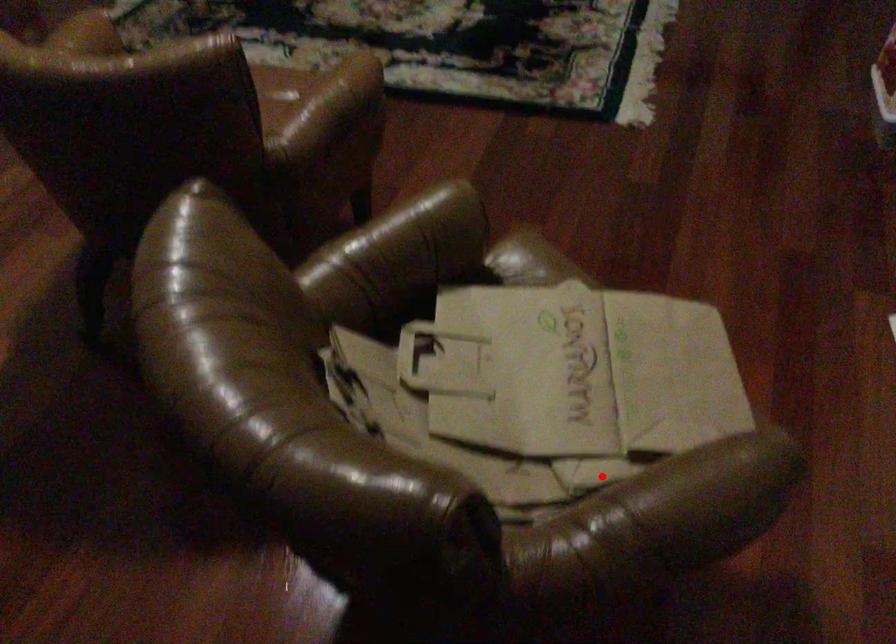
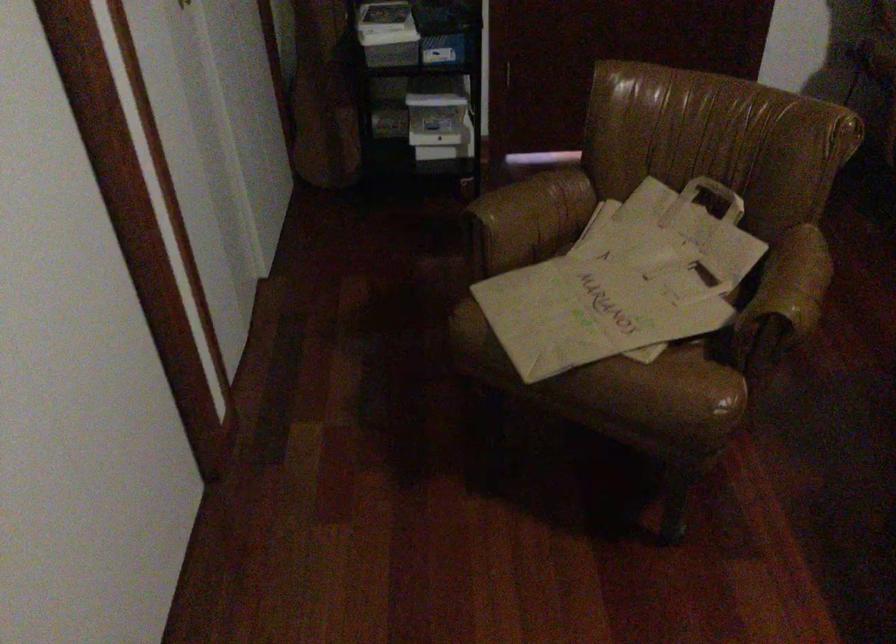
Where in the second image is the point corresponding to the highlighted location from the first image?

(532, 216)